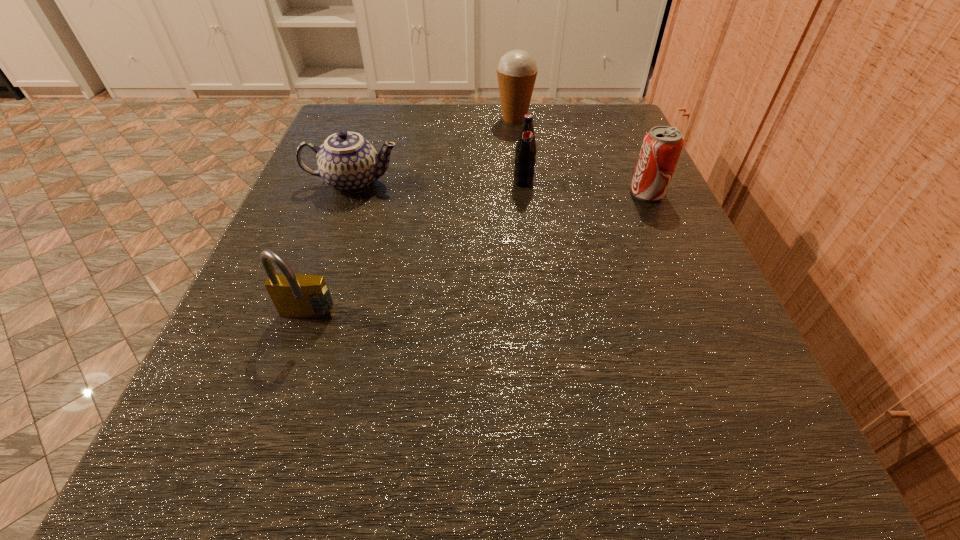
Find the location of a particular element. The image size is (960, 540). empty location between the nearest object and the chinaware is located at coordinates point(330,251).

I want to click on empty space between the icecream and the right soda can, so click(581, 156).

Locate an element on the screen. The image size is (960, 540). vacant point located between the shortest object and the right soda can is located at coordinates (500, 188).

I want to click on vacant point located between the rightmost object and the nearest object, so click(477, 256).

What are the coordinates of `empty location between the farthest object and the padlock` in the screenshot? It's located at (411, 218).

You are a GUI agent. You are given a task and a screenshot of the screen. Output one action in this format:
    pyautogui.click(x=<x>, y=<y>)
    Task: Click on the free space between the icecream and the chinaware
    This screenshot has width=960, height=540.
    Given the screenshot: What is the action you would take?
    pyautogui.click(x=434, y=151)

At what (x,y) coordinates should I click in order to perform the action: click on vacant space that is in between the rightmost object and the shortest object. Please return your answer as a coordinate pair (x, y). The image size is (960, 540). Looking at the image, I should click on (500, 188).

This screenshot has width=960, height=540. I want to click on free space between the right soda can and the left soda can, so click(x=586, y=188).

Where is `vacant region between the farthest object and the shortest object`? vacant region between the farthest object and the shortest object is located at coordinates (434, 151).

Where is `free spot between the left soda can and the rightmost object`? This screenshot has height=540, width=960. free spot between the left soda can and the rightmost object is located at coordinates (586, 188).